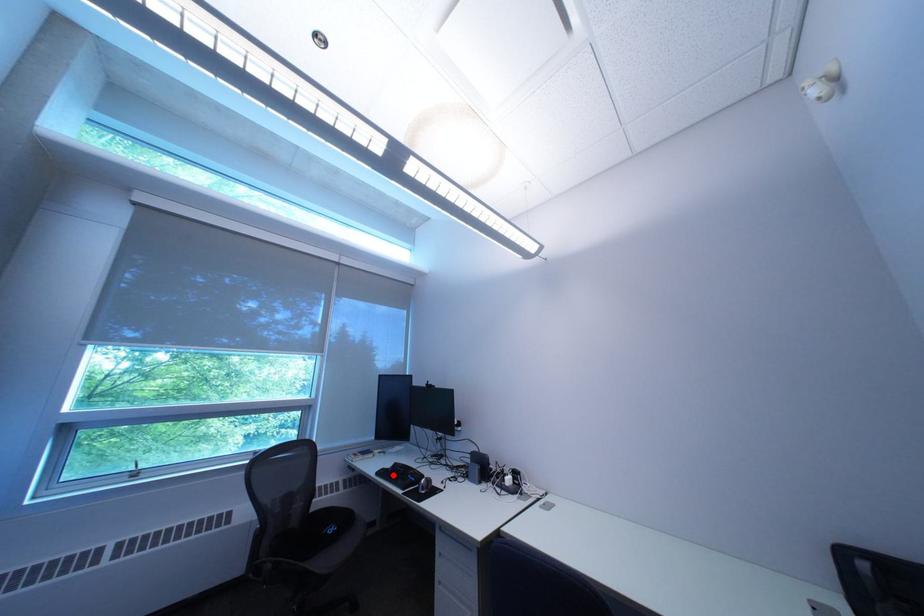
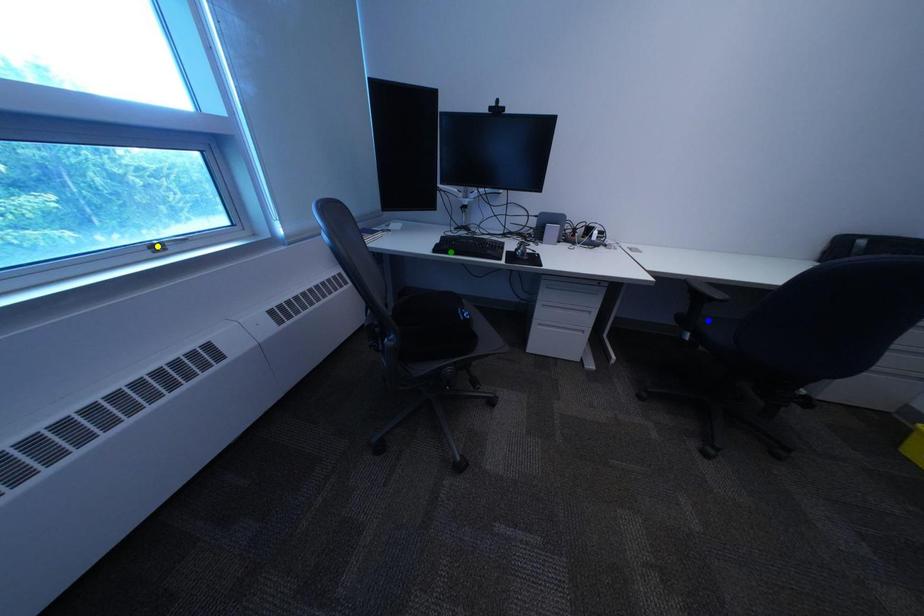
Question: I am providing you with two images of the same scene from different viewpoints. A red point is marked on the first image. You are given multiple points on the second image. Which point in image 2 represents the same 3d spot as the red point in image 1?

Choices:
 (A) green point
 (B) blue point
 (C) yellow point

Answer: (A)